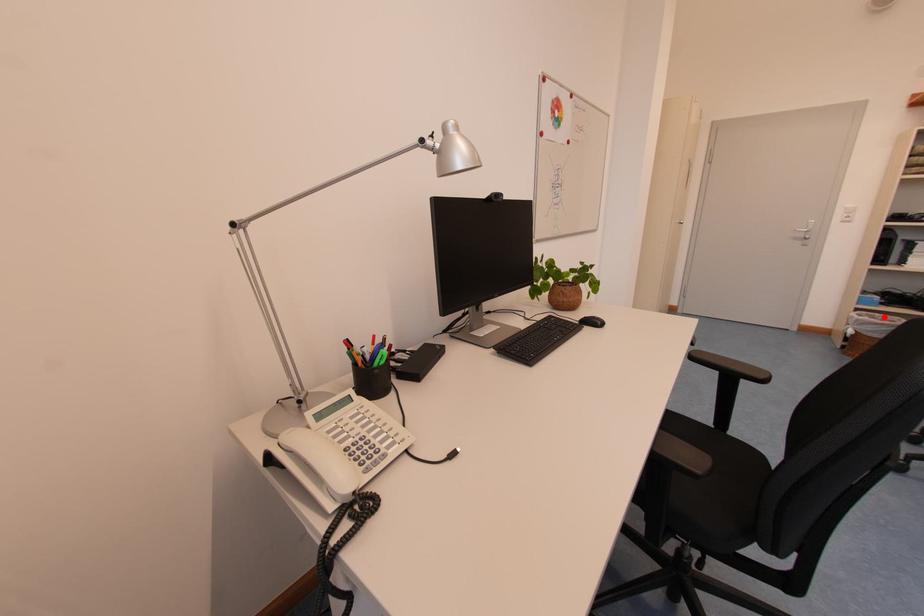
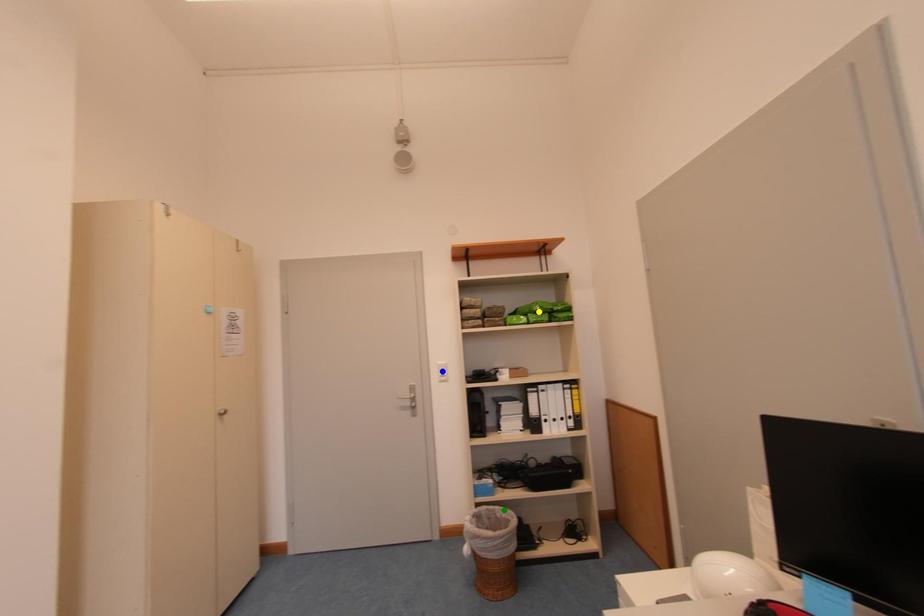
Question: I am providing you with two images of the same scene from different viewpoints. A red point is marked on the first image. You are given multiple points on the second image. Which spot in image 2 lines up with the point in image 1?

Choices:
 (A) yellow point
 (B) blue point
 (C) green point

Answer: (C)